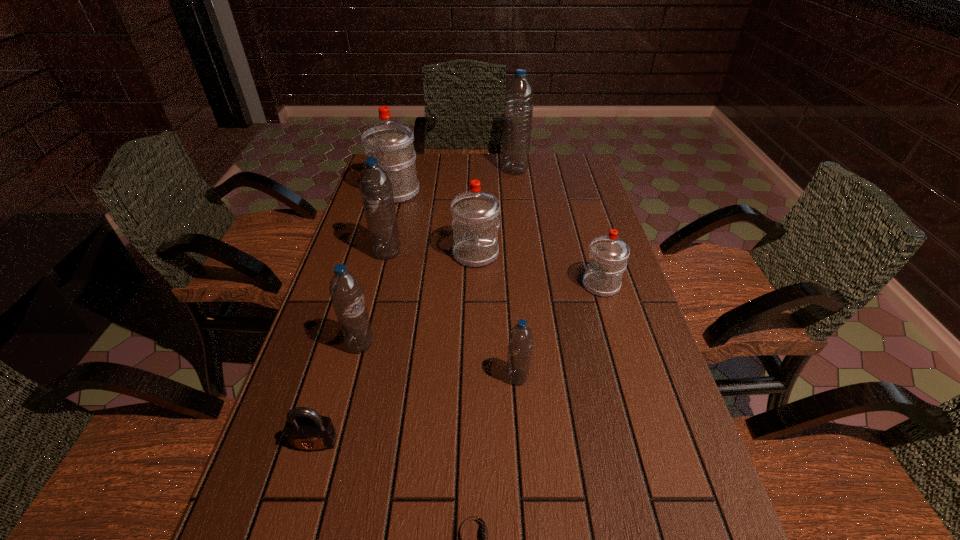
Image resolution: width=960 pixels, height=540 pixels. In order to click on free space in the image that satisfies the following two spatial constraints: 1. on the back side of the seventh farthest object; 2. on the handle side of the eighth nearest object in this screenshot , I will do `click(503, 192)`.

Find the location of a particular element. Image resolution: width=960 pixels, height=540 pixels. free space that satisfies the following two spatial constraints: 1. on the handle side of the second farthest water bottle; 2. on the front of the gray padlock near the keyhole is located at coordinates (328, 442).